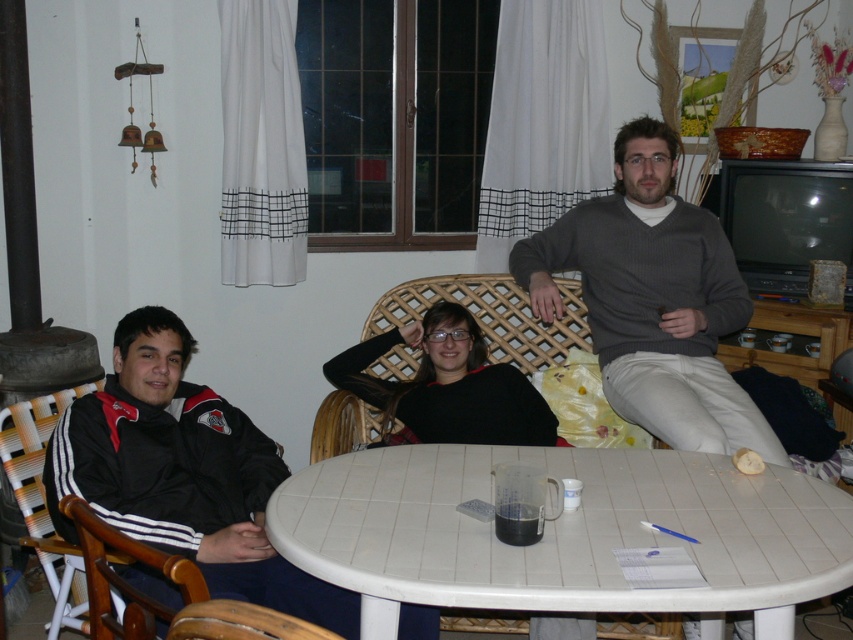
Question: Which is nearer to the black sweater at center?

Choices:
 (A) gray sweater at center
 (B) white tile table at center

Answer: (A)

Question: Is black fabric jacket at left above black sweater at center?

Choices:
 (A) no
 (B) yes

Answer: (A)

Question: Which is farther from the white tile table at center?

Choices:
 (A) black fabric jacket at left
 (B) black sweater at center

Answer: (B)

Question: Is black fabric jacket at left wider than gray sweater at center?

Choices:
 (A) no
 (B) yes

Answer: (B)

Question: Which point is farther to the camera?

Choices:
 (A) gray sweater at center
 (B) black fabric jacket at left
 (C) white tile table at center

Answer: (A)

Question: Can you confirm if white tile table at center is positioned above gray sweater at center?

Choices:
 (A) yes
 (B) no

Answer: (B)